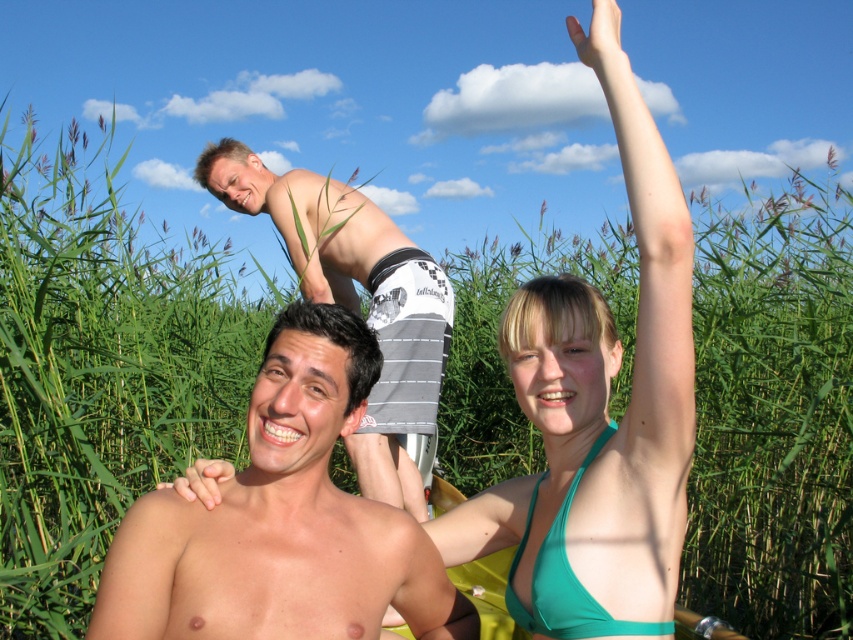
What do you see at coordinates (598, 410) in the screenshot? Image resolution: width=853 pixels, height=640 pixels. I see `teal bikini top at upper right` at bounding box center [598, 410].

Between point (548, 522) and point (306, 209), which one is positioned in front?

Positioned in front is point (548, 522).

Find the location of a particular element. teal bikini top at upper right is located at coordinates (598, 410).

Is teal bikini top at upper right positioned at the back of smooth skin man at center?

→ Yes, it is behind smooth skin man at center.

Describe the element at coordinates (598, 410) in the screenshot. I see `teal bikini top at upper right` at that location.

Does point (595, 458) come behind point (340, 624)?

Yes, it is.

You are a GUI agent. You are given a task and a screenshot of the screen. Output one action in this format:
    pyautogui.click(x=<x>, y=<y>)
    Task: Click on the teal bikini top at upper right
    The width and height of the screenshot is (853, 640).
    Given the screenshot: What is the action you would take?
    pos(598,410)

Can you confirm if smooth skin man at center is positioned to the right of gray striped shorts at upper center?

Yes, smooth skin man at center is to the right of gray striped shorts at upper center.

Does smooth skin man at center have a lesser height compared to gray striped shorts at upper center?

Indeed, smooth skin man at center has a lesser height compared to gray striped shorts at upper center.

Is point (325, 476) closer to viewer compared to point (405, 502)?

Yes, point (325, 476) is in front of point (405, 502).

Locate an element on the screen. smooth skin man at center is located at coordinates (283, 518).